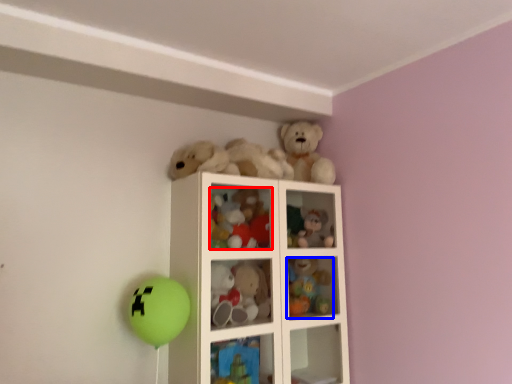
Question: Which object is further to the camera taking this photo, toy (highlighted by a red box) or toy (highlighted by a blue box)?

Choices:
 (A) toy
 (B) toy

Answer: (B)